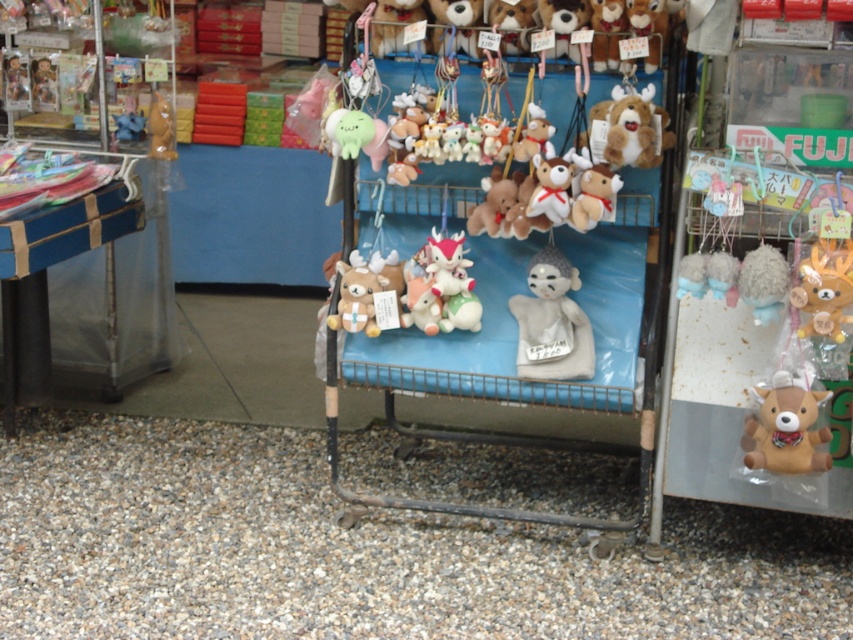
Question: Does brown plush deer at lower right come in front of matte brown bear at upper left?

Choices:
 (A) yes
 (B) no

Answer: (A)

Question: Estimate the real-world distances between objects in this image. Which object is farther from the brown plush deer at lower right?

Choices:
 (A) velvet plush toys at center
 (B) white fabric figurine at center

Answer: (B)

Question: Which object appears closest to the camera in this image?

Choices:
 (A) matte brown bear at upper left
 (B) brown plush deer at lower right
 (C) velvet plush toys at center
 (D) white fabric figurine at center

Answer: (B)

Question: Observing the image, what is the correct spatial positioning of brown plush deer at lower right in reference to brown plush toy at right?

Choices:
 (A) right
 (B) left

Answer: (B)

Question: Which point is closer to the camera taking this photo?

Choices:
 (A) 817,292
 (B) 154,129
 (C) 540,438

Answer: (A)

Question: Does velvet plush toys at center appear on the right side of brown plush deer at lower right?

Choices:
 (A) no
 (B) yes

Answer: (A)